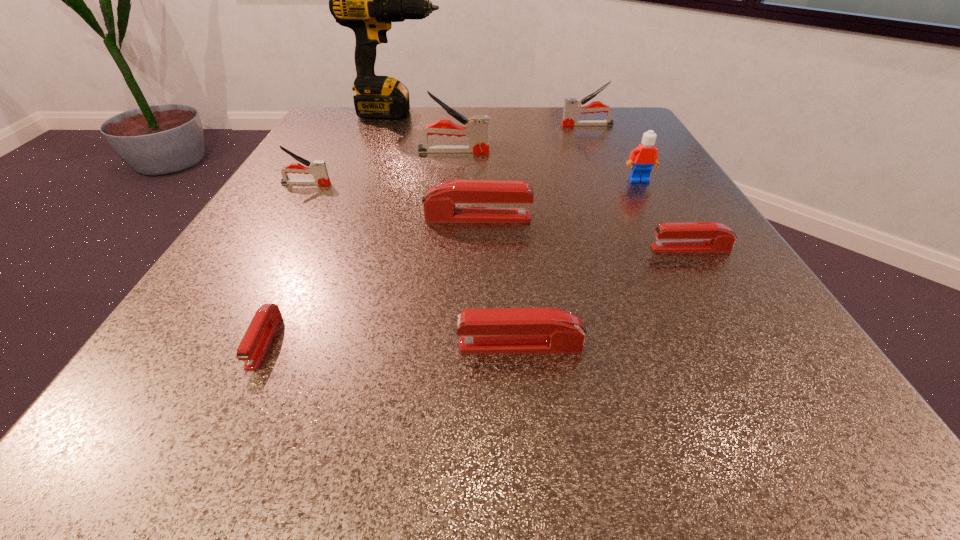
You are a GUI agent. You are given a task and a screenshot of the screen. Output one action in this format:
    pyautogui.click(x=<x>, y=<y>)
    Task: Click on the free space located on the handle side of the farthest gray stapler
    The image size is (960, 540).
    Given the screenshot: What is the action you would take?
    pyautogui.click(x=516, y=125)

Where is `free region located 0.250m on the handle side of the farthest gray stapler`? This screenshot has width=960, height=540. free region located 0.250m on the handle side of the farthest gray stapler is located at coordinates (456, 125).

Locate an element on the screen. free space located on the face of the Lego is located at coordinates (694, 281).

You are a GUI agent. You are given a task and a screenshot of the screen. Output one action in this format:
    pyautogui.click(x=<x>, y=<y>)
    Task: Click on the vacant space located 0.190m on the handle side of the nearest gray stapler
    
    Given the screenshot: What is the action you would take?
    pyautogui.click(x=430, y=184)

This screenshot has height=540, width=960. Find the location of `vacant space located 0.050m on the front-facing side of the fourth nearest object`. vacant space located 0.050m on the front-facing side of the fourth nearest object is located at coordinates (561, 218).

The image size is (960, 540). What are the coordinates of `blank area located on the front-facing side of the fifth tallest stapler` in the screenshot? It's located at (245, 346).

This screenshot has width=960, height=540. Identify the location of vacant space located on the front-facing side of the fifth tallest stapler. (302, 346).

The image size is (960, 540). Find the location of `free space located on the front-facing side of the fifth tallest stapler`. free space located on the front-facing side of the fifth tallest stapler is located at coordinates (368, 346).

Find the location of a particular element. The width and height of the screenshot is (960, 540). free region located 0.370m on the front-facing side of the fifth farthest stapler is located at coordinates (413, 248).

The height and width of the screenshot is (540, 960). Find the location of `free space located on the front-facing side of the fifth farthest stapler`. free space located on the front-facing side of the fifth farthest stapler is located at coordinates click(x=419, y=248).